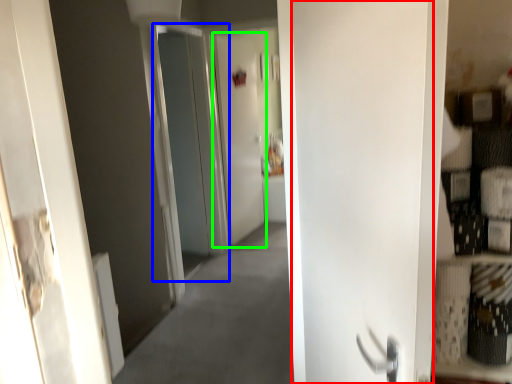
Question: Based on their relative distances, which object is nearer to door (highlighted by a red box)? Choose from screen door (highlighted by a blue box) and screen door (highlighted by a green box).

Choices:
 (A) screen door
 (B) screen door

Answer: (A)